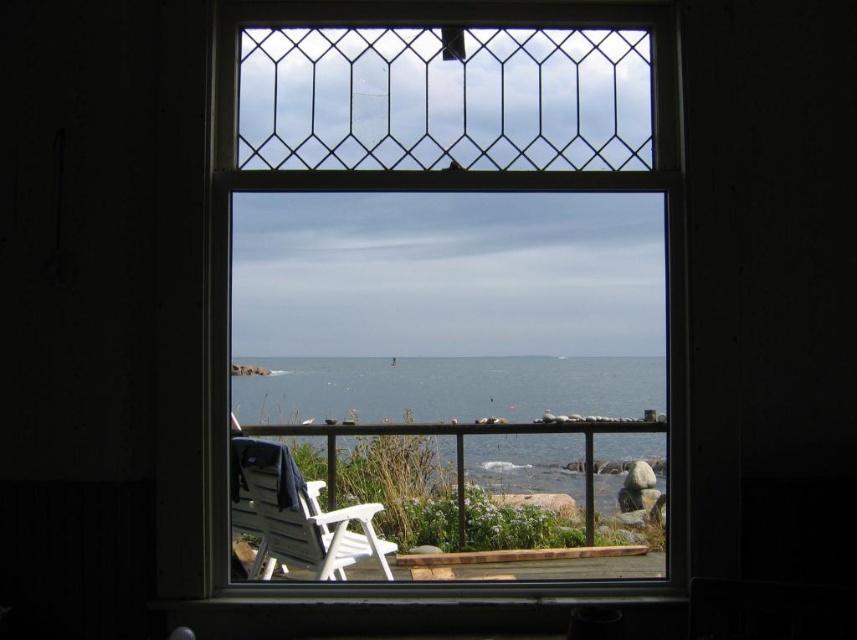
Based on the photo, you are standing inside a room and looking through the clear glass window at center. Can you see the blue water at center beyond the window?

Yes, the clear glass window at center is in front of blue water at center, so the blue water at center can be seen through the window.

You are standing in a room with a window. There is a point at coordinates (446,284). Is this point located on the clear glass window at center?

Yes, the point at coordinates (446,284) is on the clear glass window at center according to the description.

Based on the photo, you are standing in a room with a window showing a coastal view. You see the blue water at center and the white plastic rocking chair at lower center. Which object is higher in the image?

The blue water at center is located above the white plastic rocking chair at lower center, so the blue water at center is higher in the image.